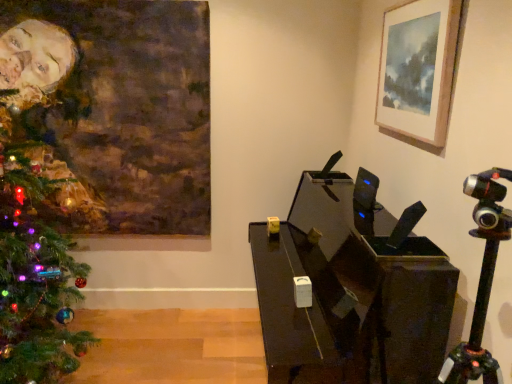
The image size is (512, 384). What do you see at coordinates (34, 278) in the screenshot? I see `green matte christmas tree at left` at bounding box center [34, 278].

Describe the element at coordinates (418, 69) in the screenshot. Image resolution: width=512 pixels, height=384 pixels. I see `wooden picture frame at upper right, positioned as the first picture frame in right-to-left order` at that location.

In order to click on green matte christmas tree at left in this screenshot , I will do `click(34, 278)`.

Considering the positions of objects wooden picture frame at upper right, positioned as the first picture frame in right-to-left order, and green matte christmas tree at left in the image provided, who is more to the left, wooden picture frame at upper right, positioned as the first picture frame in right-to-left order, or green matte christmas tree at left?

green matte christmas tree at left is more to the left.

Are wooden picture frame at upper right, positioned as the first picture frame in right-to-left order, and green matte christmas tree at left located far from each other?

wooden picture frame at upper right, positioned as the first picture frame in right-to-left order, is positioned a significant distance from green matte christmas tree at left.

Considering the sizes of wooden picture frame at upper right, marked as the 1th picture frame in a front-to-back arrangement, and green matte christmas tree at left in the image, is wooden picture frame at upper right, marked as the 1th picture frame in a front-to-back arrangement, wider or thinner than green matte christmas tree at left?

Clearly, wooden picture frame at upper right, marked as the 1th picture frame in a front-to-back arrangement, has less width compared to green matte christmas tree at left.

From a real-world perspective, between wooden picture frame at upper right, the 2th picture frame positioned from the left, and green matte christmas tree at left, who is vertically higher?

In real-world perspective, wooden picture frame at upper right, the 2th picture frame positioned from the left, is above.

From the picture: Considering the sizes of objects green matte christmas tree at left and wooden picture frame at upper right, marked as the 1th picture frame in a front-to-back arrangement, in the image provided, who is taller, green matte christmas tree at left or wooden picture frame at upper right, marked as the 1th picture frame in a front-to-back arrangement,?

Standing taller between the two is green matte christmas tree at left.

From a real-world perspective, which is physically above, green matte christmas tree at left or wooden picture frame at upper right, marked as the 1th picture frame in a front-to-back arrangement?

wooden picture frame at upper right, marked as the 1th picture frame in a front-to-back arrangement.

Does point (2, 158) appear closer or farther from the camera than point (384, 63)?

Point (2, 158) is positioned farther from the camera compared to point (384, 63).

Does green matte christmas tree at left have a greater width compared to wooden picture frame at upper right, the 2th picture frame positioned from the left?

Yes, green matte christmas tree at left is wider than wooden picture frame at upper right, the 2th picture frame positioned from the left.

From the image's perspective, which is below, oil painting portrait at left, the first picture frame in the back-to-front sequence, or green matte christmas tree at left?

green matte christmas tree at left, from the image's perspective.

From the green matte christmas tree at left, count 1st picture frame to the right and point to it. Please provide its 2D coordinates.

[(117, 108)]

Does oil painting portrait at left, acting as the 1th picture frame starting from the left, have a lesser width compared to green matte christmas tree at left?

Yes.

Which of these two, oil painting portrait at left, the first picture frame in the back-to-front sequence, or green matte christmas tree at left, stands taller?

green matte christmas tree at left.

The image size is (512, 384). Find the location of `picture frame below the wooden picture frame at upper right, the 2th picture frame positioned from the left (from the image's perspective)`. picture frame below the wooden picture frame at upper right, the 2th picture frame positioned from the left (from the image's perspective) is located at coordinates (117, 108).

Between point (188, 72) and point (380, 96), which one is positioned in front?

The point (380, 96) is closer to the camera.

Can you see oil painting portrait at left, acting as the 1th picture frame starting from the left, touching wooden picture frame at upper right, positioned as the first picture frame in right-to-left order?

There is a gap between oil painting portrait at left, acting as the 1th picture frame starting from the left, and wooden picture frame at upper right, positioned as the first picture frame in right-to-left order.

Can you confirm if green matte christmas tree at left is wider than oil painting portrait at left, which appears as the second picture frame when viewed from the front?

Correct, the width of green matte christmas tree at left exceeds that of oil painting portrait at left, which appears as the second picture frame when viewed from the front.

From the picture: Is green matte christmas tree at left spatially inside oil painting portrait at left, the first picture frame in the back-to-front sequence, or outside of it?

green matte christmas tree at left exists outside the volume of oil painting portrait at left, the first picture frame in the back-to-front sequence.

Which of these two, green matte christmas tree at left or oil painting portrait at left, the first picture frame in the back-to-front sequence, stands shorter?

oil painting portrait at left, the first picture frame in the back-to-front sequence.

Is green matte christmas tree at left far away from oil painting portrait at left, which appears as the second picture frame when viewed from the front?

That's not correct — green matte christmas tree at left is a little close to oil painting portrait at left, which appears as the second picture frame when viewed from the front.

Between wooden picture frame at upper right, marked as the 1th picture frame in a front-to-back arrangement, and oil painting portrait at left, the 2th picture frame in the right-to-left sequence, which one has larger width?

Wider between the two is oil painting portrait at left, the 2th picture frame in the right-to-left sequence.

From the image's perspective, is wooden picture frame at upper right, marked as the 1th picture frame in a front-to-back arrangement, above or below oil painting portrait at left, the 2th picture frame in the right-to-left sequence?

Based on their image positions, wooden picture frame at upper right, marked as the 1th picture frame in a front-to-back arrangement, is located above oil painting portrait at left, the 2th picture frame in the right-to-left sequence.

Can you tell me how much wooden picture frame at upper right, the 2th picture frame positioned from the left, and oil painting portrait at left, the 2th picture frame in the right-to-left sequence, differ in facing direction?

The angular difference between wooden picture frame at upper right, the 2th picture frame positioned from the left, and oil painting portrait at left, the 2th picture frame in the right-to-left sequence, is 89.5 degrees.

Is wooden picture frame at upper right, the 2th picture frame positioned from the left, placed right next to oil painting portrait at left, the first picture frame in the back-to-front sequence?

No, wooden picture frame at upper right, the 2th picture frame positioned from the left, is not next to oil painting portrait at left, the first picture frame in the back-to-front sequence.

Where is `christmas tree in front of the wooden picture frame at upper right, placed as the 2th picture frame when sorted from back to front`? christmas tree in front of the wooden picture frame at upper right, placed as the 2th picture frame when sorted from back to front is located at coordinates coord(34,278).

The width and height of the screenshot is (512, 384). What are the coordinates of `the 1st picture frame behind when counting from the green matte christmas tree at left` in the screenshot? It's located at tap(418, 69).

Based on their spatial positions, is oil painting portrait at left, the first picture frame in the back-to-front sequence, or green matte christmas tree at left further from wooden picture frame at upper right, marked as the 1th picture frame in a front-to-back arrangement?

green matte christmas tree at left.

When comparing their distances from oil painting portrait at left, acting as the 1th picture frame starting from the left, does wooden picture frame at upper right, placed as the 2th picture frame when sorted from back to front, or green matte christmas tree at left seem further?

wooden picture frame at upper right, placed as the 2th picture frame when sorted from back to front, lies further to oil painting portrait at left, acting as the 1th picture frame starting from the left, than the other object.

Looking at the image, which one is located further to green matte christmas tree at left, wooden picture frame at upper right, marked as the 1th picture frame in a front-to-back arrangement, or oil painting portrait at left, acting as the 1th picture frame starting from the left?

Based on the image, wooden picture frame at upper right, marked as the 1th picture frame in a front-to-back arrangement, appears to be further to green matte christmas tree at left.

Which object lies further to the anchor point green matte christmas tree at left, oil painting portrait at left, acting as the 1th picture frame starting from the left, or wooden picture frame at upper right, placed as the 2th picture frame when sorted from back to front?

wooden picture frame at upper right, placed as the 2th picture frame when sorted from back to front, is further to green matte christmas tree at left.

Considering their positions, is green matte christmas tree at left positioned further to wooden picture frame at upper right, placed as the 2th picture frame when sorted from back to front, than oil painting portrait at left, the first picture frame in the back-to-front sequence?

green matte christmas tree at left.

From the image, which object appears to be nearer to oil painting portrait at left, the 2th picture frame in the right-to-left sequence, green matte christmas tree at left or wooden picture frame at upper right, positioned as the first picture frame in right-to-left order?

green matte christmas tree at left is closer to oil painting portrait at left, the 2th picture frame in the right-to-left sequence.

Identify the location of picture frame between green matte christmas tree at left and wooden picture frame at upper right, the 2th picture frame positioned from the left, from left to right. Image resolution: width=512 pixels, height=384 pixels. [x=117, y=108].